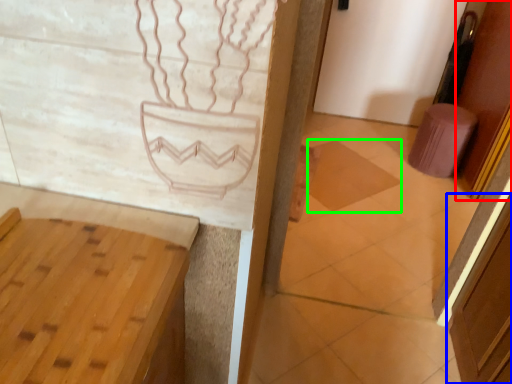
Question: Which is farther away from door (highlighted by a red box)? screen door (highlighted by a blue box) or tile (highlighted by a green box)?

Choices:
 (A) screen door
 (B) tile

Answer: (A)